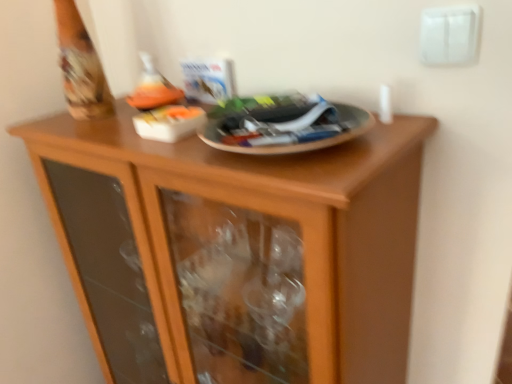
Question: Based on their positions, is matte orange wine bottle at upper center located to the left or right of white plastic electric outlet at upper right?

Choices:
 (A) left
 (B) right

Answer: (A)

Question: From the image's perspective, is matte orange wine bottle at upper center above or below white plastic electric outlet at upper right?

Choices:
 (A) below
 (B) above

Answer: (A)

Question: Which object is the closest to the wooden cabinet at center?

Choices:
 (A) white plastic electric outlet at upper right
 (B) matte orange wine bottle at upper center

Answer: (B)

Question: Which is nearer to the white plastic electric outlet at upper right?

Choices:
 (A) matte orange wine bottle at upper center
 (B) wooden cabinet at center

Answer: (A)